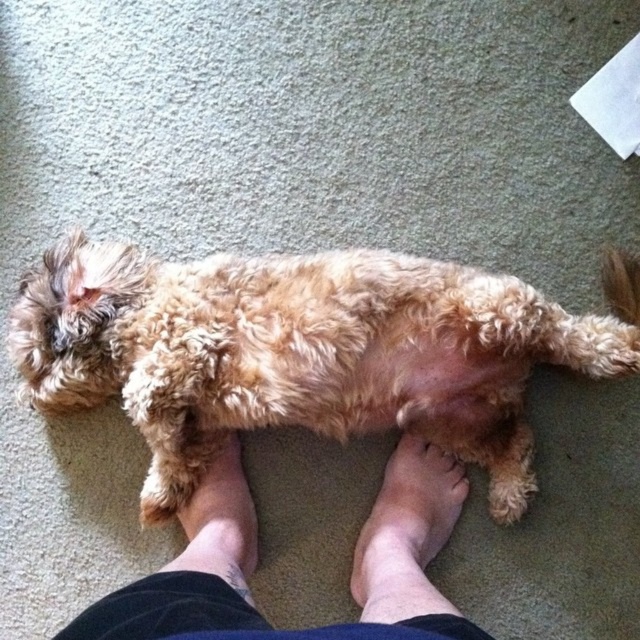
Question: Is fuzzy golden dog at center wider than light brown skin at center?

Choices:
 (A) yes
 (B) no

Answer: (A)

Question: Estimate the real-world distances between objects in this image. Which object is closer to the light brown skin at center?

Choices:
 (A) fuzzy golden dog at center
 (B) brown furry foot at center
 (C) barefoot feet at center

Answer: (C)

Question: Can you confirm if light brown skin at center is positioned to the left of brown furry foot at center?

Choices:
 (A) no
 (B) yes

Answer: (A)

Question: Is fuzzy golden dog at center closer to the viewer compared to barefoot feet at center?

Choices:
 (A) no
 (B) yes

Answer: (A)

Question: Which point appears farthest from the camera in this image?

Choices:
 (A) (220, 465)
 (B) (131, 628)
 (C) (596, 356)

Answer: (A)

Question: Considering the real-world distances, which object is farthest from the fuzzy golden dog at center?

Choices:
 (A) brown furry foot at center
 (B) light brown skin at center

Answer: (B)